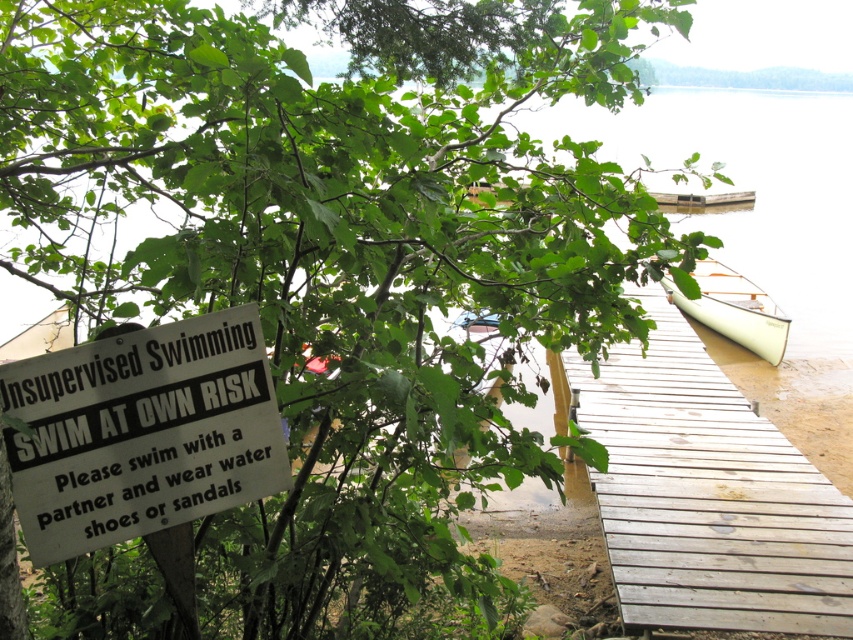
Is white paper sign at left thinner than white matte boat at right?

Correct, white paper sign at left's width is less than white matte boat at right's.

This screenshot has height=640, width=853. What do you see at coordinates (141, 433) in the screenshot?
I see `white paper sign at left` at bounding box center [141, 433].

Is point (204, 477) positioned after point (697, 307)?

No, (204, 477) is closer to viewer.

Where is `white paper sign at left`? The height and width of the screenshot is (640, 853). white paper sign at left is located at coordinates (141, 433).

Is white paper sign at left bigger than clear water at center?

Actually, white paper sign at left might be smaller than clear water at center.

This screenshot has height=640, width=853. What are the coordinates of `white paper sign at left` in the screenshot? It's located at (141, 433).

You are a GUI agent. You are given a task and a screenshot of the screen. Output one action in this format:
    pyautogui.click(x=<x>, y=<y>)
    Task: Click on the white paper sign at left
    
    Given the screenshot: What is the action you would take?
    pyautogui.click(x=141, y=433)

Can you confirm if clear water at center is positioned to the left of white matte boat at right?

Incorrect, clear water at center is not on the left side of white matte boat at right.

Can you confirm if clear water at center is bigger than white matte boat at right?

Actually, clear water at center might be smaller than white matte boat at right.

Which is behind, point (811, 259) or point (700, 262)?

Positioned behind is point (811, 259).

You are a GUI agent. You are given a task and a screenshot of the screen. Output one action in this format:
    pyautogui.click(x=<x>, y=<y>)
    Task: Click on the clear water at center
    The height and width of the screenshot is (640, 853).
    Given the screenshot: What is the action you would take?
    pyautogui.click(x=747, y=188)